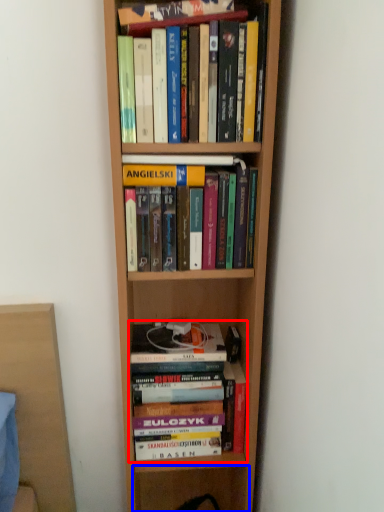
Question: Which of the following is the closest to the observer, book (highlighted by a red box) or shelf (highlighted by a blue box)?

Choices:
 (A) book
 (B) shelf

Answer: (A)